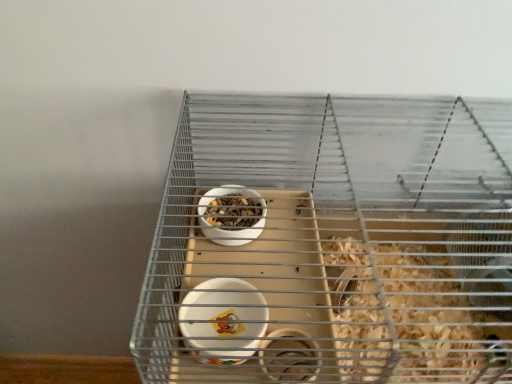
This screenshot has width=512, height=384. I want to click on metallic wire bird cage at center, so click(x=333, y=244).

This screenshot has height=384, width=512. Describe the element at coordinates (333, 244) in the screenshot. I see `metallic wire bird cage at center` at that location.

Looking at this image, what is the approximate height of metallic wire bird cage at center?

metallic wire bird cage at center is 11.48 inches in height.

At what (x,y) coordinates should I click in order to perform the action: click on metallic wire bird cage at center. Please return your answer as a coordinate pair (x, y). Image resolution: width=512 pixels, height=384 pixels. Looking at the image, I should click on (333, 244).